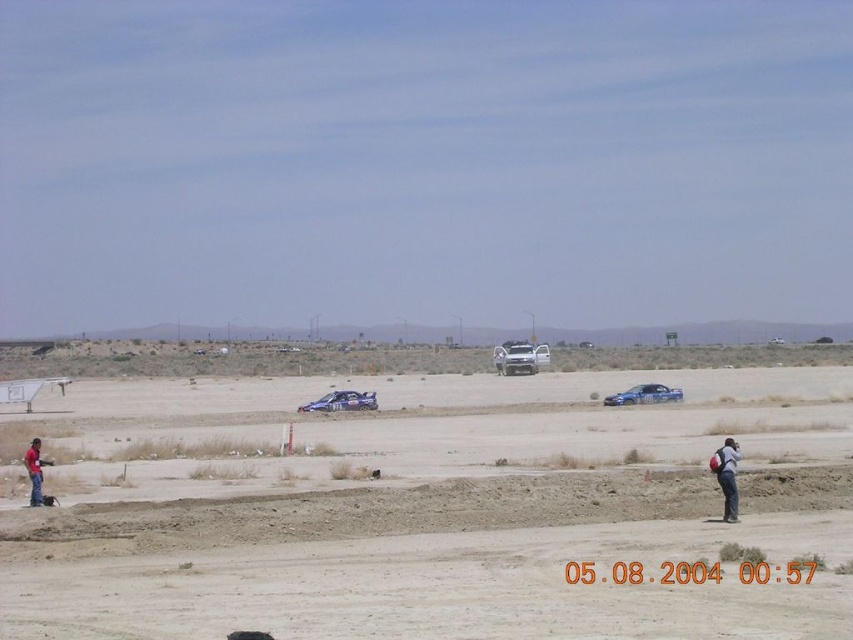
You are a spectator at the desert race and want to know the position of the dull brown dirt at center relative to the white matte car at center. Which one is closer to you?

The dull brown dirt at center is in front of the white matte car at center, so it is closer to you.